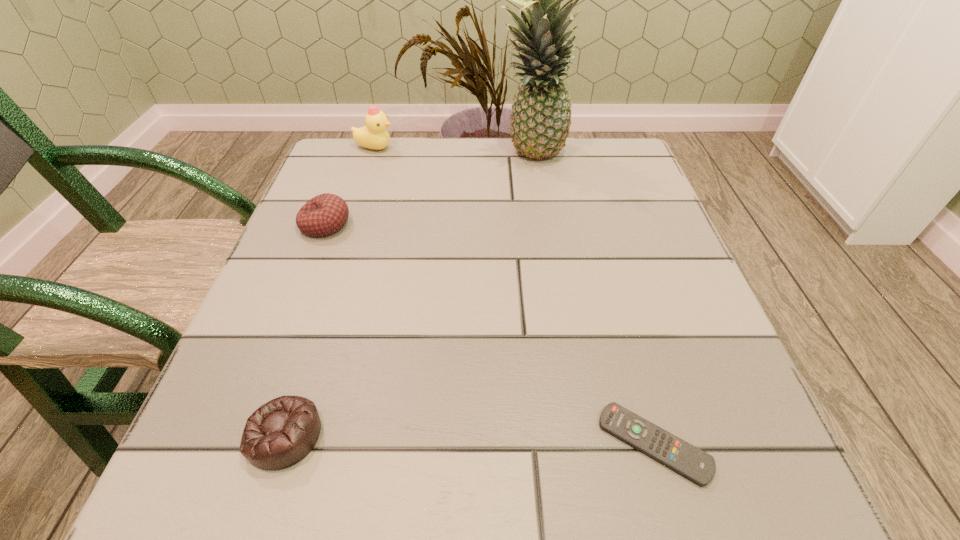
Identify the location of vacant space that satisfies the following two spatial constraints: 1. on the front-facing side of the duckling; 2. on the right side of the fourth tallest object. (283, 435).

At what (x,y) coordinates should I click in order to perform the action: click on vacant space that satisfies the following two spatial constraints: 1. on the back side of the shorter beanbag; 2. on the front-facing side of the duckling. Please return your answer as a coordinate pair (x, y). The image size is (960, 540). Looking at the image, I should click on (375, 148).

Locate an element on the screen. vacant region that satisfies the following two spatial constraints: 1. on the back side of the shorter beanbag; 2. on the right side of the tallest object is located at coordinates (373, 155).

At what (x,y) coordinates should I click in order to perform the action: click on vacant space that satisfies the following two spatial constraints: 1. on the back side of the remote control; 2. on the front-facing side of the duckling. Please return your answer as a coordinate pair (x, y). Looking at the image, I should click on (571, 148).

Find the location of a particular element. The image size is (960, 540). free space that satisfies the following two spatial constraints: 1. on the front-facing side of the duckling; 2. on the back side of the shorter beanbag is located at coordinates (283, 435).